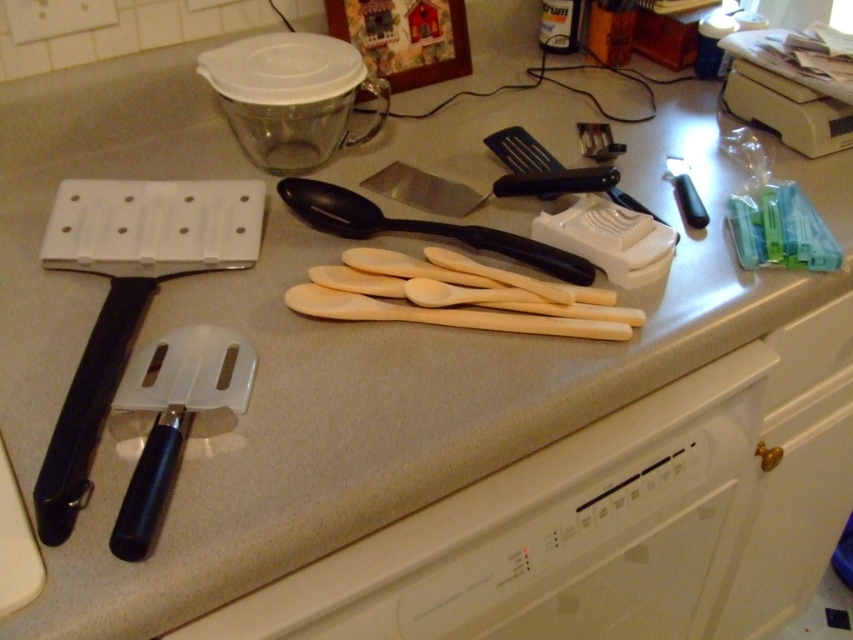
Between white glossy oven at lower center and black plastic spoon at center, which one has less height?

Standing shorter between the two is black plastic spoon at center.

Consider the image. Does white glossy oven at lower center appear on the left side of black plastic spoon at center?

No, white glossy oven at lower center is not to the left of black plastic spoon at center.

Who is more distant from viewer, (692, 442) or (366, 236)?

The point (366, 236) is behind.

At what (x,y) coordinates should I click in order to perform the action: click on white glossy oven at lower center. Please return your answer as a coordinate pair (x, y). This screenshot has width=853, height=640. Looking at the image, I should click on (549, 536).

Is transparent glass jar at upper center bigger than black plastic spoon at center?

Indeed, transparent glass jar at upper center has a larger size compared to black plastic spoon at center.

Does transparent glass jar at upper center have a lesser width compared to black plastic spoon at center?

Indeed, transparent glass jar at upper center has a lesser width compared to black plastic spoon at center.

Is point (379, 92) closer to camera compared to point (556, 266)?

No, (379, 92) is further to viewer.

I want to click on transparent glass jar at upper center, so click(289, 97).

Who is taller, black plastic spatula at left or transparent glass jar at upper center?

With more height is black plastic spatula at left.

Can you confirm if black plastic spatula at left is positioned below transparent glass jar at upper center?

Yes.

At what (x,y) coordinates should I click in order to perform the action: click on black plastic spatula at left. Please return your answer as a coordinate pair (x, y). Looking at the image, I should click on (128, 296).